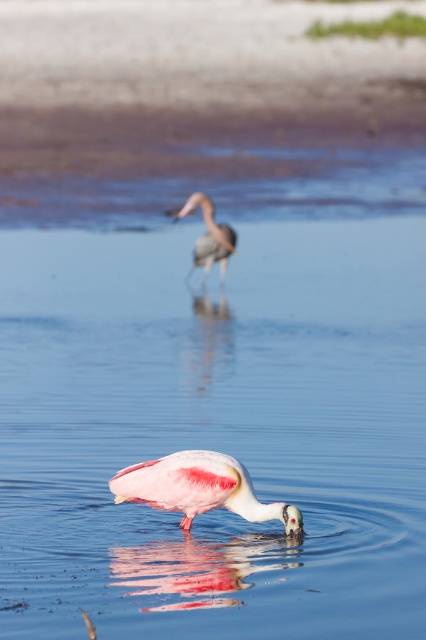
You are a nature photographer observing the scene. You want to capture a clear photo of the pink matte spoonbill at center without the pink matte bird at center blocking it. Can you adjust your camera angle to achieve this?

The pink matte spoonbill at center is positioned under the pink matte bird at center, so adjusting the camera angle downward might allow you to capture the spoonbill without the bird blocking it.

You are a wildlife photographer observing the scene. You need to capture a photo where both the pink matte spoonbill at center and the pink matte bird at center are visible. Which bird will appear smaller in the photo?

The pink matte spoonbill at center will appear smaller in the photo because it is not as tall as the pink matte bird at center, but since it is closer to the camera, its apparent size might be similar depending on the distance. However, based on height alone, the spoonbill is shorter.

In the scene shown: You are a photographer trying to capture both the pink matte spoonbill at center and the pink matte bird at center in a single frame. Based on their positions and sizes, which bird should you focus on to ensure both are clearly visible in your shot?

The pink matte spoonbill at center might be wider than the pink matte bird at center, so focusing on the pink matte spoonbill at center would help ensure both are clearly visible as it occupies more space in the frame.